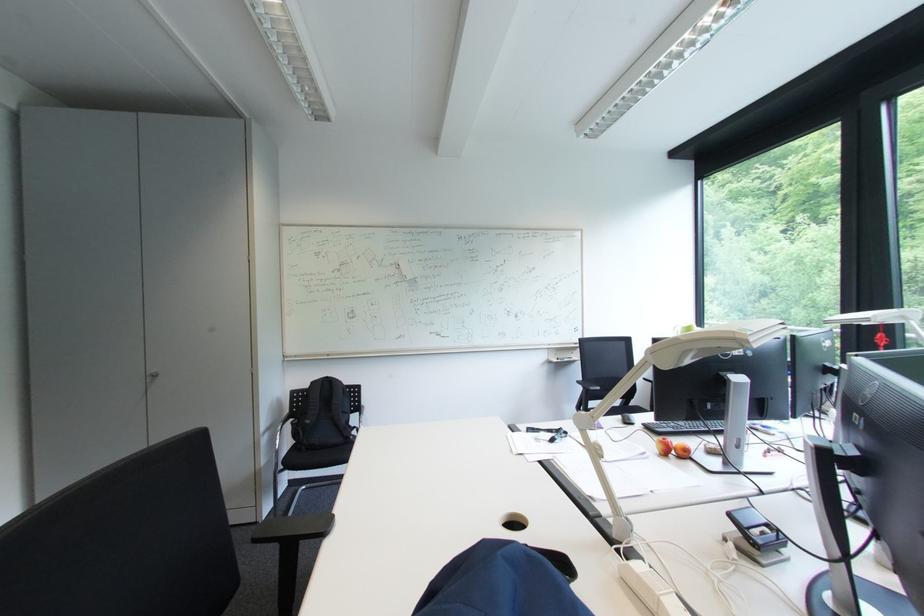
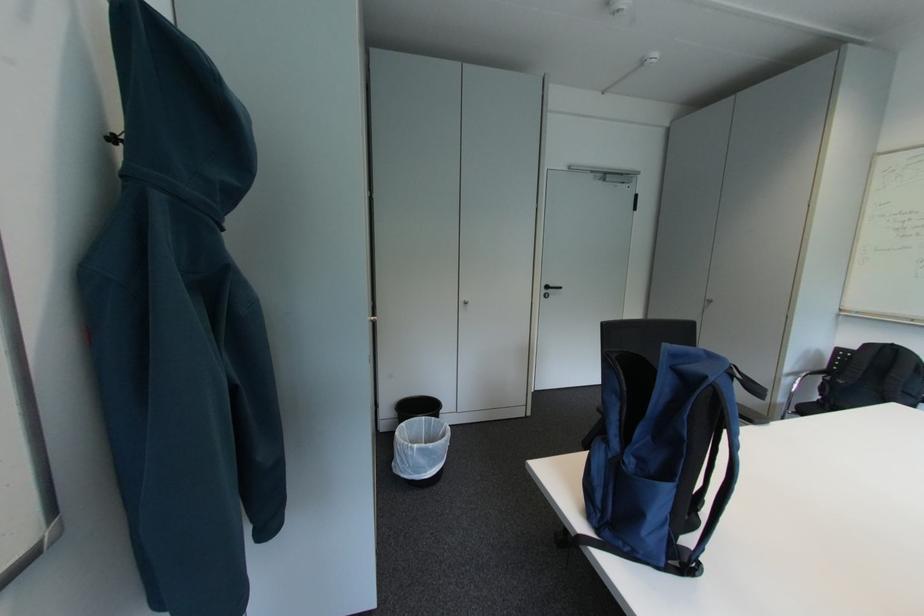
Find the pixel in the second image that matches pixel 277 426 in the first image.

(806, 371)